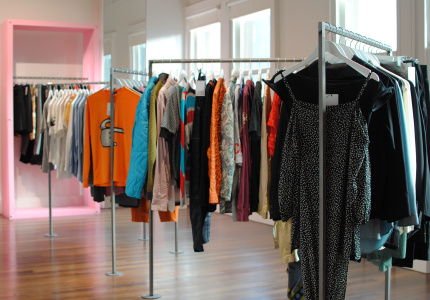
This screenshot has width=430, height=300. Find the location of `windows`. windows is located at coordinates (252, 38), (199, 43), (378, 17), (137, 50), (105, 65).